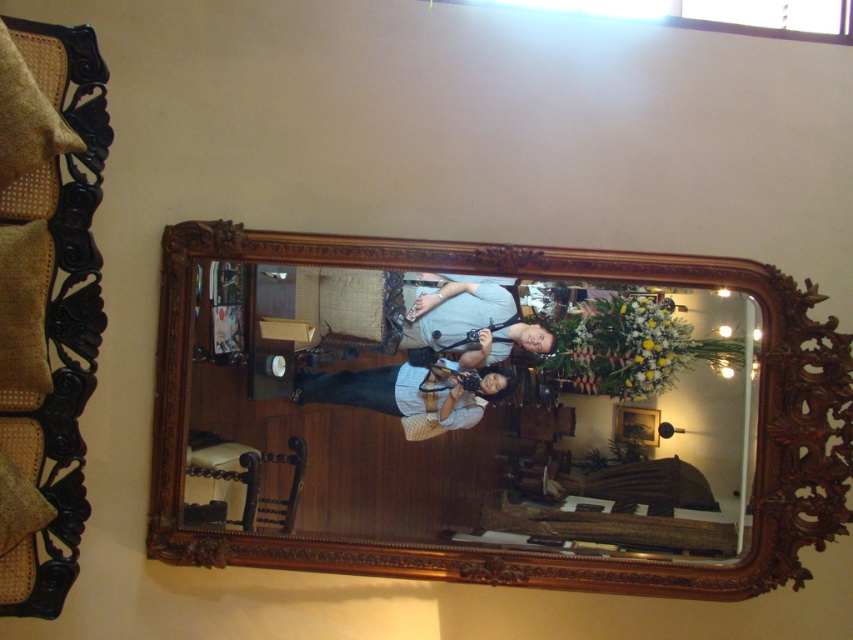
You are standing in front of the wooden mirror at center and want to locate the point at coordinates (468,406). Where exactly on the mirror should you look?

The point at coordinates (468,406) is located on the wooden mirror at center.

You are holding a 15 centimeter ruler and want to measure the distance between the wooden mirror at center and the matte gray shirt at center in the image. Can your ruler reach that distance?

The wooden mirror at center is 16.27 centimeters from the matte gray shirt at center. Since your ruler is only 15 centimeters long, it cannot fully measure the distance between them.